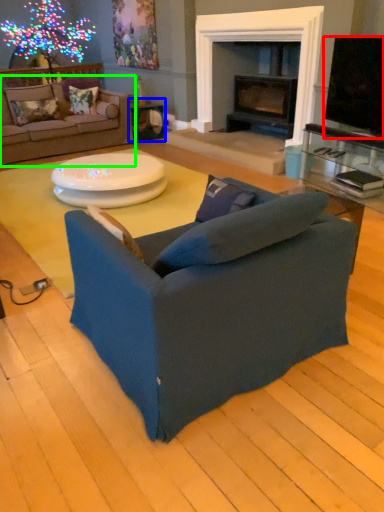
Question: Which object is positioned closest to television (highlighted by a red box)? Select from table (highlighted by a blue box) and studio couch (highlighted by a green box).

Choices:
 (A) table
 (B) studio couch

Answer: (A)